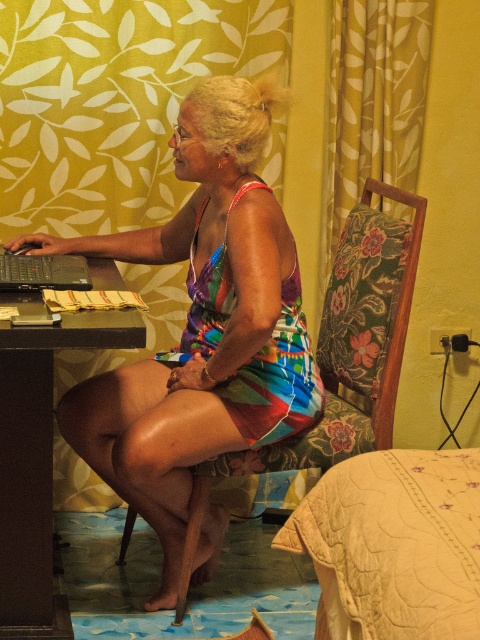
You are moving a large piece of furniture that is 1.5 meters wide. You need to place it in the room shown. Which object between the beige quilted bed at lower right and the black plastic table at left can it fit next to without overlapping?

The beige quilted bed at lower right has a larger width than the black plastic table at left, so the large furniture piece can fit next to the beige quilted bed at lower right.

You are a delivery robot that needs to place a small package between the multicolored fabric dress at center and the black plastic table at left. The package is 10 inches long. Can you fit it in the space between them?

The space between the multicolored fabric dress at center and the black plastic table at left is 12.93 inches. Since the package is 10 inches long, it can fit in the space between them.